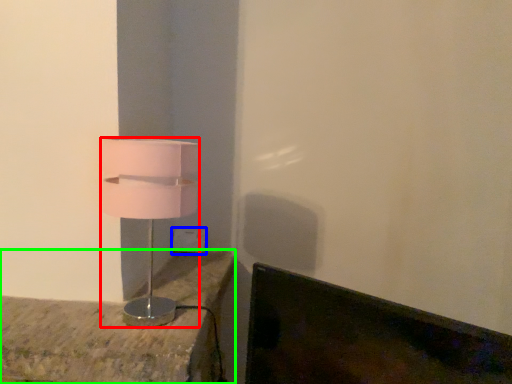
Question: Estimate the real-world distances between objects in this image. Which object is farther from lamp (highlighted by a red box), electric outlet (highlighted by a blue box) or furniture (highlighted by a green box)?

Choices:
 (A) electric outlet
 (B) furniture

Answer: (A)